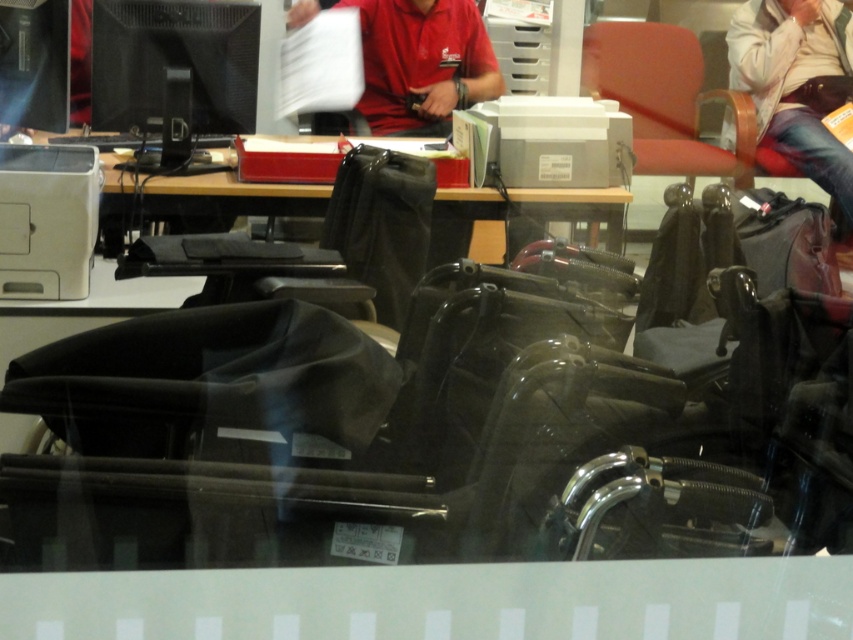
Who is more forward, (349, 477) or (729, 157)?

Point (349, 477) is in front.

Can you confirm if black plastic wheelchair at center is shorter than matte red chair at upper right?

Indeed, black plastic wheelchair at center has a lesser height compared to matte red chair at upper right.

Is point (457, 328) farther from camera compared to point (693, 173)?

No, (457, 328) is closer to viewer.

Find the location of a particular element. This screenshot has width=853, height=640. black plastic wheelchair at center is located at coordinates coord(428,435).

Does matte red chair at upper right appear on the left side of matte black monitor at upper left?

No, matte red chair at upper right is not to the left of matte black monitor at upper left.

The image size is (853, 640). What are the coordinates of `matte red chair at upper right` in the screenshot? It's located at (665, 99).

Between point (198, 40) and point (701, 100), which one is positioned in front?

Point (198, 40)

At what (x,y) coordinates should I click in order to perform the action: click on black matte monitor at upper left. Please return your answer as a coordinate pair (x, y). The width and height of the screenshot is (853, 640). Looking at the image, I should click on (173, 61).

The height and width of the screenshot is (640, 853). In order to click on black matte monitor at upper left in this screenshot , I will do (173, 61).